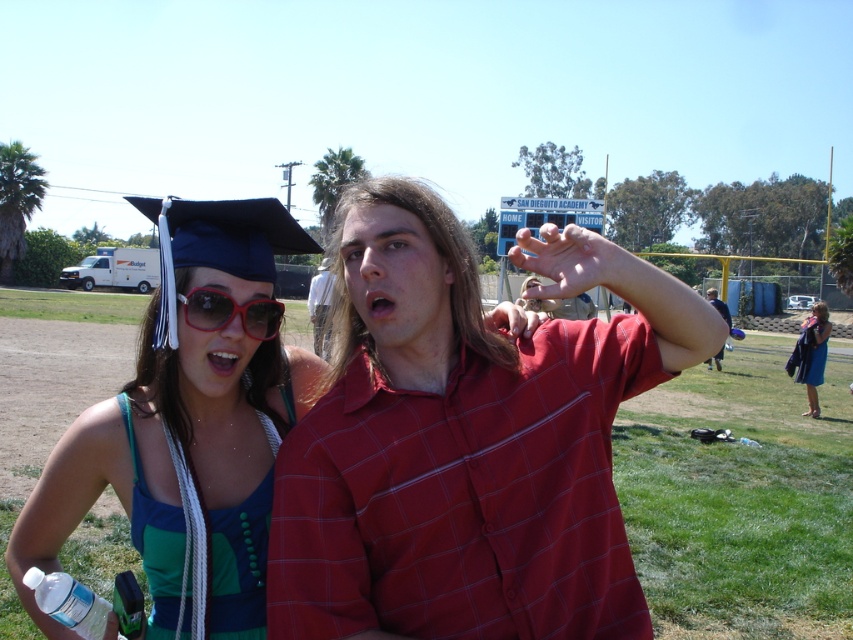
Does green satin gown at left have a greater width compared to blue satin gown at lower right?

In fact, green satin gown at left might be narrower than blue satin gown at lower right.

Can you confirm if green satin gown at left is positioned to the left of blue satin gown at lower right?

Correct, you'll find green satin gown at left to the left of blue satin gown at lower right.

Who is more distant from viewer, (177, 573) or (798, 353)?

Positioned behind is point (798, 353).

This screenshot has width=853, height=640. Identify the location of green satin gown at left. (238, 564).

Can you confirm if red plaid shirt at center is smaller than green satin gown at left?

No.

Image resolution: width=853 pixels, height=640 pixels. What do you see at coordinates (468, 440) in the screenshot? I see `red plaid shirt at center` at bounding box center [468, 440].

This screenshot has width=853, height=640. In order to click on red plaid shirt at center in this screenshot , I will do `click(468, 440)`.

Does point (198, 568) come behind point (144, 504)?

No, (198, 568) is closer to viewer.

Is point (76, 490) positioned in front of point (187, 604)?

No, it is not.

At what (x,y) coordinates should I click in order to perform the action: click on matte blue graduation cap at upper left. Please return your answer as a coordinate pair (x, y). The height and width of the screenshot is (640, 853). Looking at the image, I should click on (186, 432).